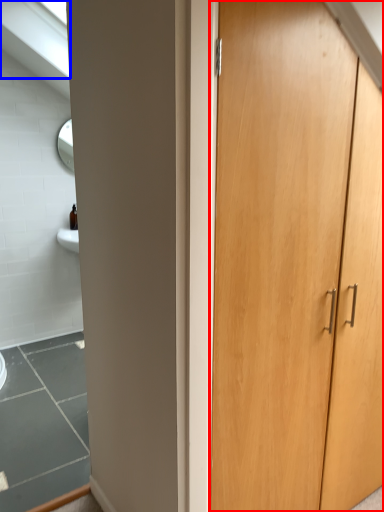
Question: Which object is closer to the camera taking this photo, cupboard (highlighted by a red box) or window (highlighted by a blue box)?

Choices:
 (A) cupboard
 (B) window

Answer: (A)